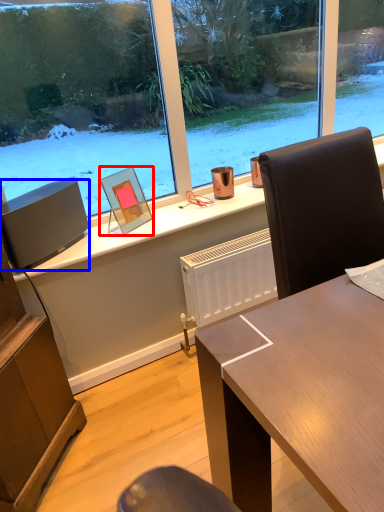
Question: Which object is further to the camera taking this photo, picture frame (highlighted by a red box) or loudspeaker (highlighted by a blue box)?

Choices:
 (A) picture frame
 (B) loudspeaker

Answer: (A)